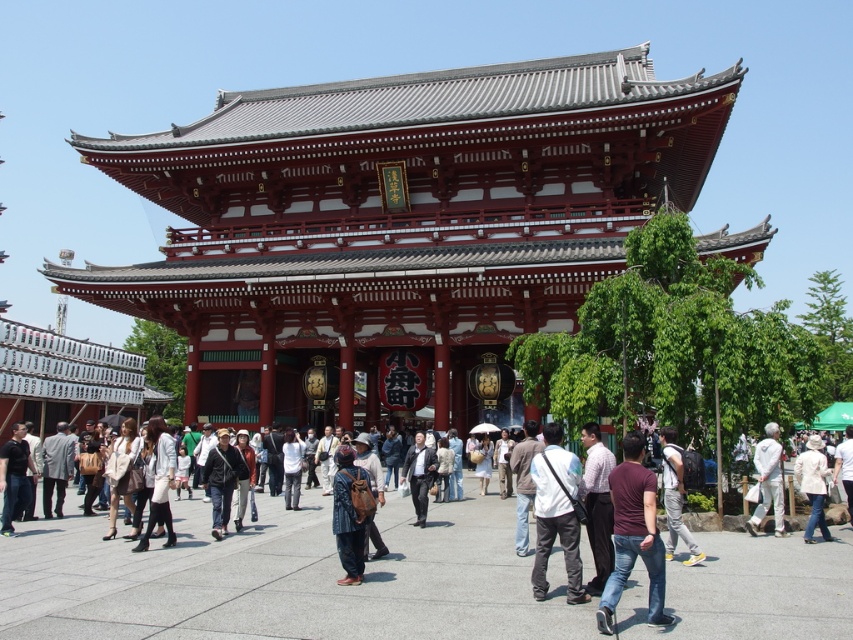
Question: Based on their relative distances, which object is farther from the dark gray suit at center?

Choices:
 (A) dark gray backpack at center
 (B) white cotton shirt at lower right
 (C) light beige fabric jacket at center
 (D) dark maroon shirt at center

Answer: (D)

Question: Which object appears farthest from the camera in this image?

Choices:
 (A) dark gray backpack at center
 (B) matte red temple gate at center
 (C) white matte shirt at center
 (D) brown leather backpack at center

Answer: (B)

Question: Is matte red temple gate at center above dark maroon shirt at center?

Choices:
 (A) yes
 (B) no

Answer: (A)

Question: Is light beige fabric jacket at center behind dark gray suit at center?

Choices:
 (A) yes
 (B) no

Answer: (B)

Question: Which point is closer to the camera taking this photo?

Choices:
 (A) 688,544
 (B) 413,492

Answer: (A)

Question: Is matte red temple gate at center smaller than white matte shirt at center?

Choices:
 (A) no
 (B) yes

Answer: (A)